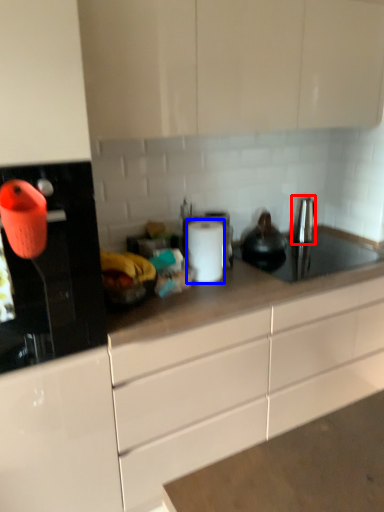
Question: Which point is closer to the camera, faucet (highlighted by a red box) or paper towel (highlighted by a blue box)?

Choices:
 (A) faucet
 (B) paper towel

Answer: (B)